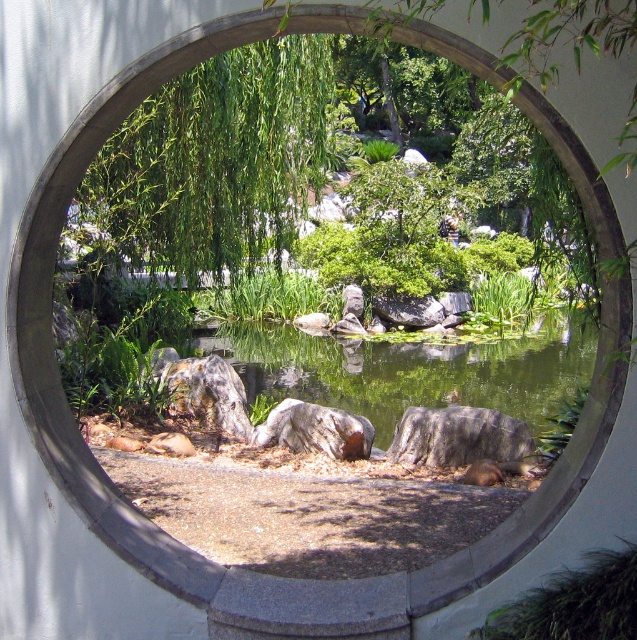
You are standing in front of the circular window structure looking at the garden scene. There are two points marked in the image, one at coordinates point (259, 160) and another at point (408, 429). Which point is closer to you?

Point (259, 160) is further to the camera than point (408, 429), so the point closer to you is point (408, 429).

You are an architect designing a miniature garden and want to place a small statue between the green leafy tree at upper left and the gray rough rock at center. Based on their sizes, which object should the statue be closer to?

The green leafy tree at upper left is larger in size than the gray rough rock at center, so the statue should be placed closer to the gray rough rock at center to balance the visual weight.